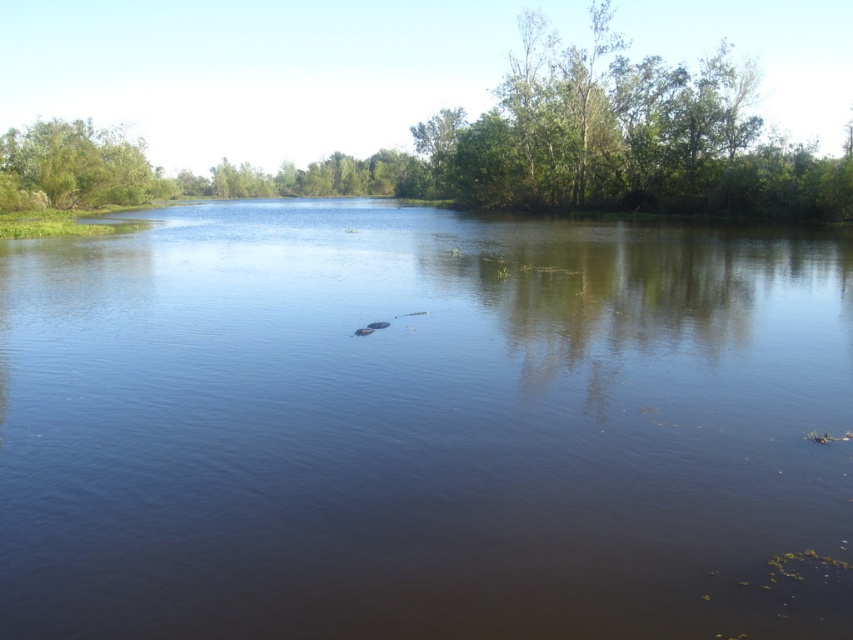
Based on the photo, is brown murky water at center shorter than green leafy trees at upper center?

Indeed, brown murky water at center has a lesser height compared to green leafy trees at upper center.

Can you confirm if brown murky water at center is smaller than green leafy trees at upper center?

Yes, brown murky water at center is smaller than green leafy trees at upper center.

Is point (213, 513) positioned before point (538, 156)?

Yes, it is in front of point (538, 156).

Where is `brown murky water at center`? This screenshot has height=640, width=853. brown murky water at center is located at coordinates (421, 426).

Where is `brown murky water at center`? The height and width of the screenshot is (640, 853). brown murky water at center is located at coordinates (421, 426).

Locate an element on the screen. This screenshot has width=853, height=640. brown murky water at center is located at coordinates (421, 426).

Does green leafy trees at upper center have a greater height compared to green leafy tree at upper left?

Correct, green leafy trees at upper center is much taller as green leafy tree at upper left.

How far apart are green leafy trees at upper center and green leafy tree at upper left?

They are 42.42 meters apart.

Does point (257, 108) come farther from viewer compared to point (57, 163)?

Yes, point (257, 108) is farther from viewer.

Image resolution: width=853 pixels, height=640 pixels. I want to click on green leafy trees at upper center, so click(x=445, y=134).